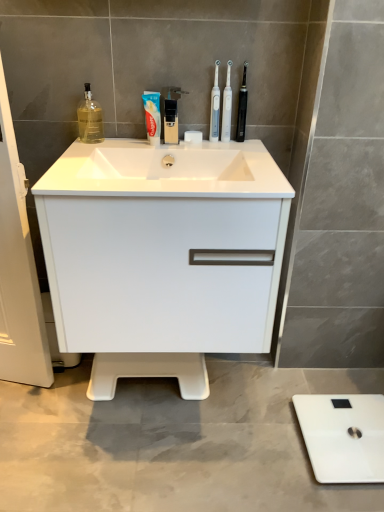
Locate an element on the screen. empty space that is ontop of white matte scale at lower right (from a real-world perspective) is located at coordinates (345, 432).